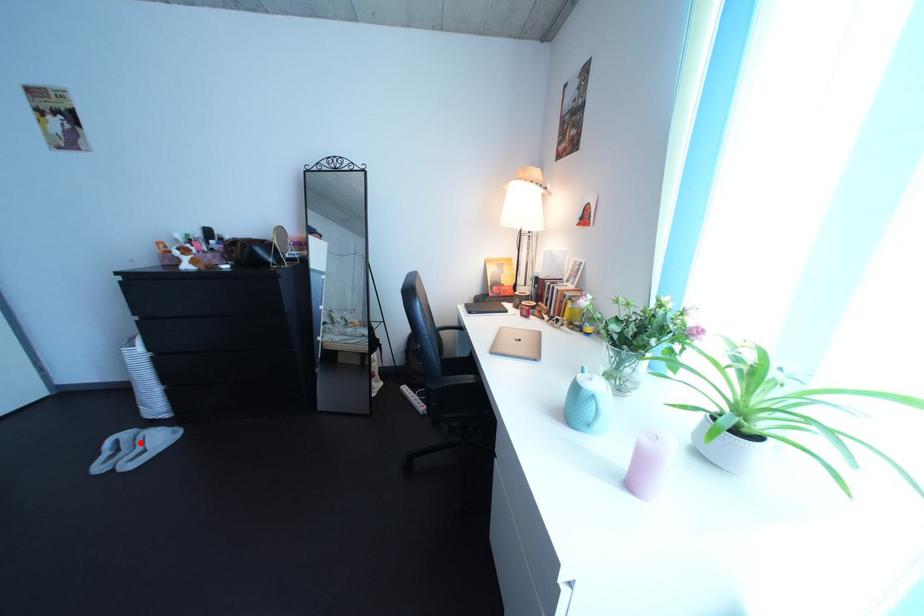
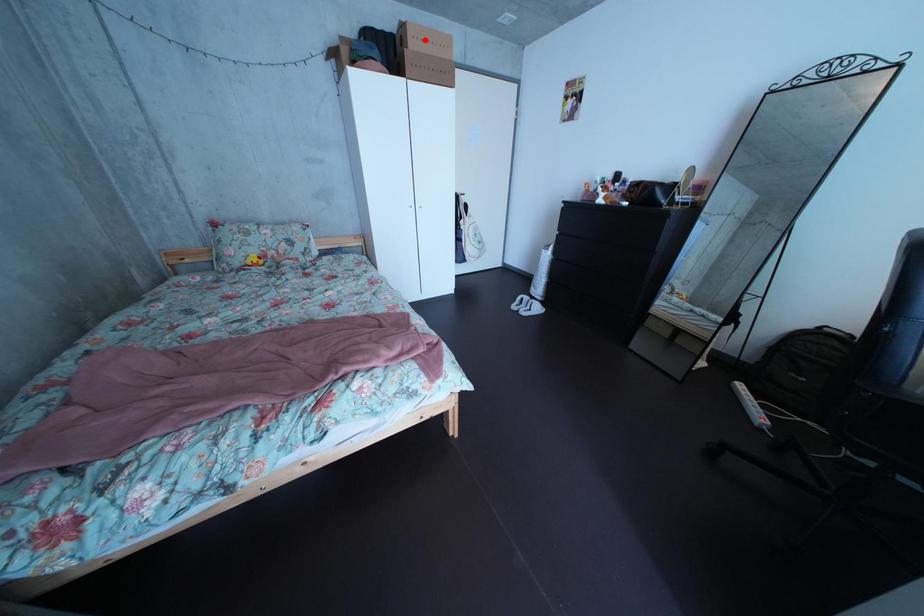
I am providing you with two images of the same scene from different viewpoints. A red point is marked on the first image and another point is marked on the second image. Are the points marked in image1 and image2 representing the same 3D position?

No